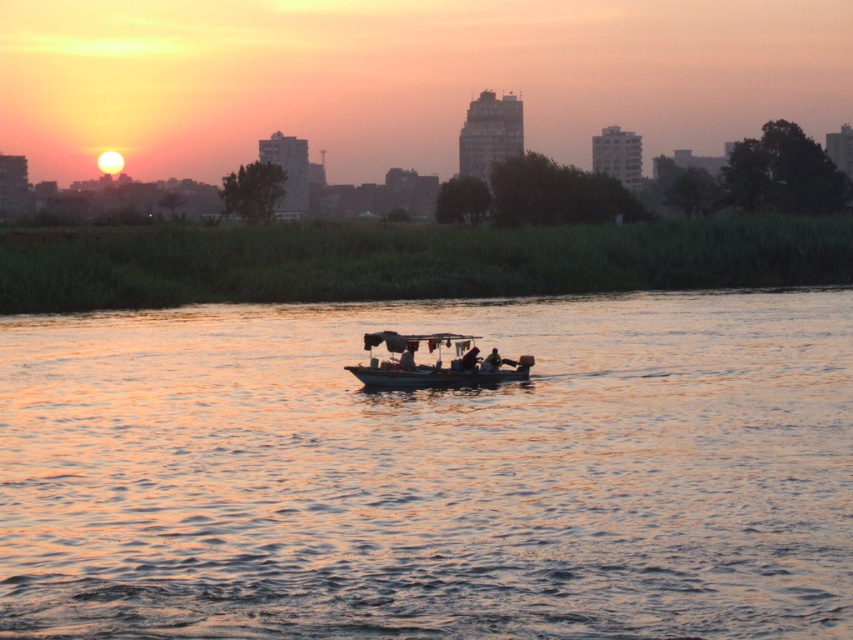
From the picture: Between smooth water at center and metallic gray boat at center, which one has more height?

smooth water at center is taller.

The width and height of the screenshot is (853, 640). What do you see at coordinates (431, 472) in the screenshot?
I see `smooth water at center` at bounding box center [431, 472].

Between point (68, 636) and point (413, 356), which one is positioned behind?

Point (413, 356)

Locate an element on the screen. The image size is (853, 640). smooth water at center is located at coordinates (431, 472).